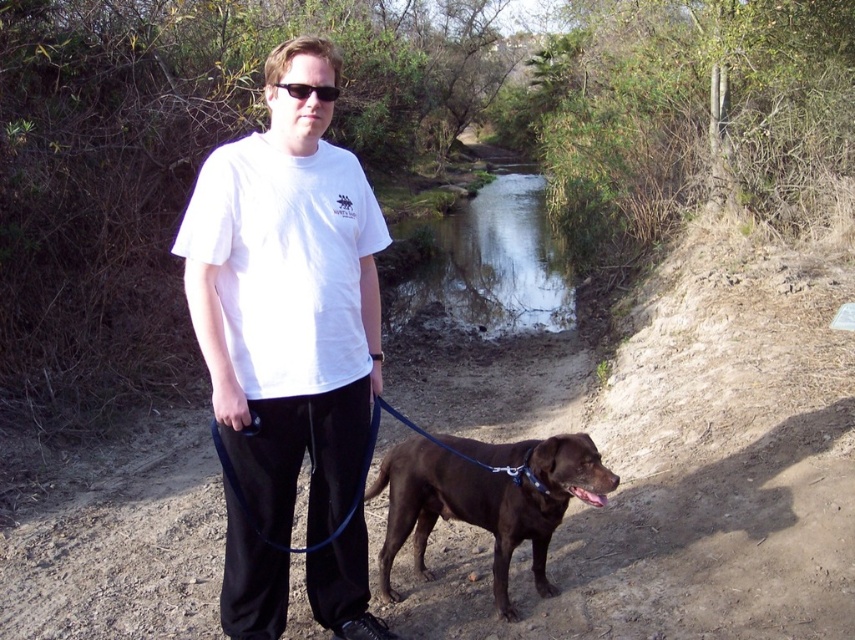
Does white cotton t-shirt at center appear under clear water at center?

Correct, white cotton t-shirt at center is located below clear water at center.

Which is more to the right, white cotton t-shirt at center or clear water at center?

clear water at center

Who is more forward, (223, 570) or (516, 173)?

Point (223, 570)

This screenshot has width=855, height=640. I want to click on white cotton t-shirt at center, so click(x=287, y=298).

Between shiny brown dog at center and black plastic sunglasses at center, which one appears on the left side from the viewer's perspective?

black plastic sunglasses at center is more to the left.

Does shiny brown dog at center have a lesser height compared to black plastic sunglasses at center?

No, shiny brown dog at center is not shorter than black plastic sunglasses at center.

Is point (382, 560) farther from viewer compared to point (286, 86)?

That is True.

The image size is (855, 640). I want to click on shiny brown dog at center, so click(x=486, y=499).

Between white cotton t-shirt at center and shiny brown dog at center, which one appears on the left side from the viewer's perspective?

white cotton t-shirt at center is more to the left.

Who is higher up, white cotton t-shirt at center or shiny brown dog at center?

white cotton t-shirt at center is above.

Does point (314, 81) lie behind point (510, 538)?

No, it is not.

At what (x,y) coordinates should I click in order to perform the action: click on white cotton t-shirt at center. Please return your answer as a coordinate pair (x, y). The image size is (855, 640). Looking at the image, I should click on (287, 298).